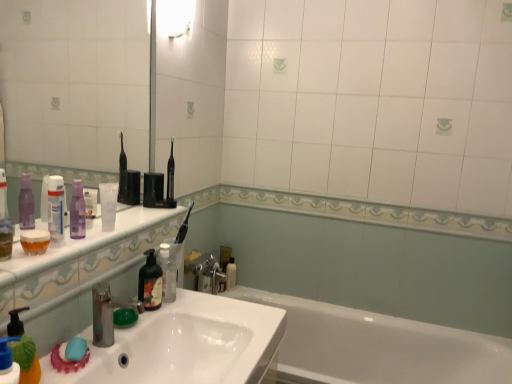
Find the location of a particular element. This screenshot has width=512, height=384. vacant area that is in front of white glossy tube at upper left, placed as the first toiletry when sorted from left to right is located at coordinates (34, 262).